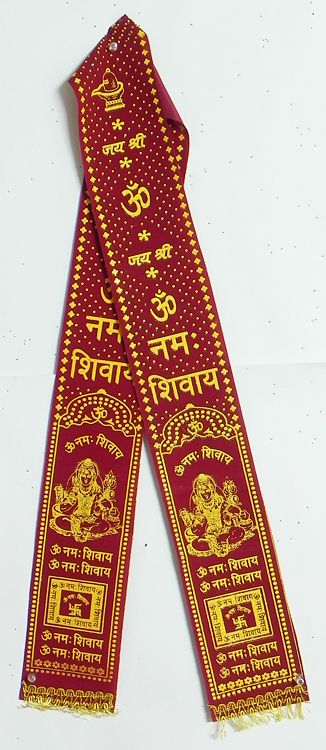
Locate an element on the screen. yellow cross stitch is located at coordinates (198, 262).